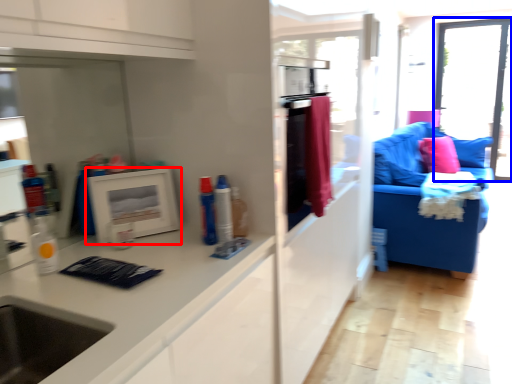
Question: Which object appears farthest to the camera in this image, picture frame (highlighted by a red box) or window (highlighted by a blue box)?

Choices:
 (A) picture frame
 (B) window

Answer: (B)